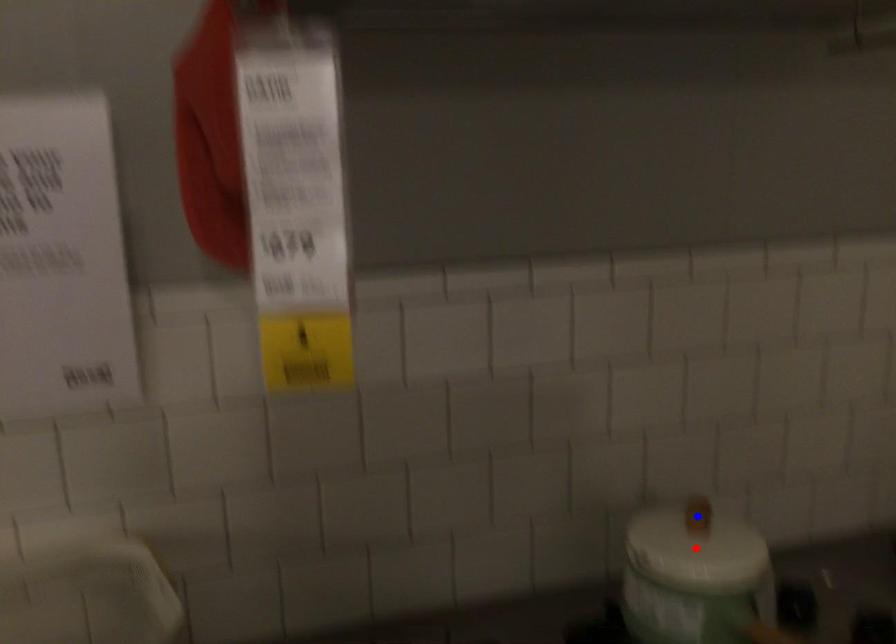
Question: Two points are marked on the image. Which point is closer to the camera?

Choices:
 (A) Blue point is closer.
 (B) Red point is closer.

Answer: (A)